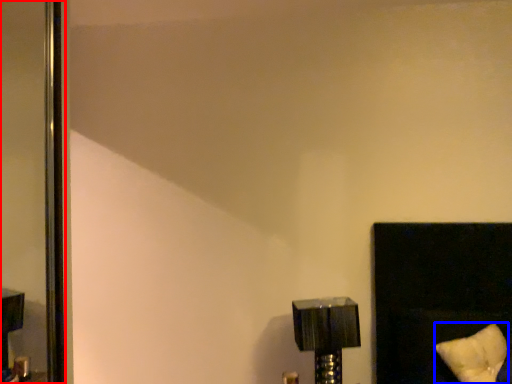
Question: Which object appears closest to the camera in this image, screen door (highlighted by a red box) or pillow (highlighted by a blue box)?

Choices:
 (A) screen door
 (B) pillow

Answer: (B)